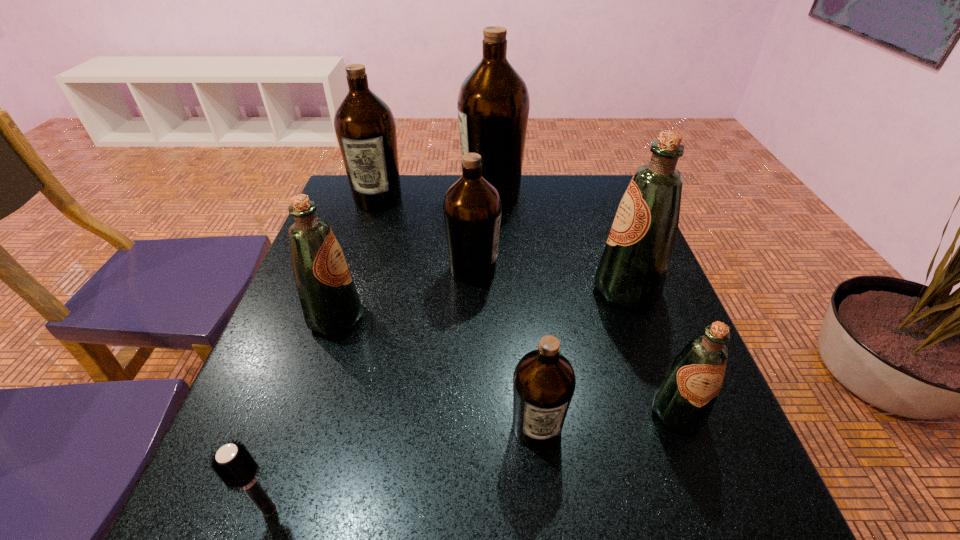
In the image, there is a desktop. Where is `vacant space at the near right corner`? vacant space at the near right corner is located at coordinates (733, 529).

This screenshot has height=540, width=960. I want to click on free space between the hairbrush and the biggest brown olive oil, so (x=380, y=352).

This screenshot has width=960, height=540. In order to click on free space between the third farthest brown olive oil and the biggest green olive oil in this screenshot , I will do `click(550, 279)`.

Locate an element on the screen. unoccupied area between the second nearest brown olive oil and the nearest green olive oil is located at coordinates (575, 341).

Identify the location of vacant area between the third smallest brown olive oil and the smallest green olive oil. (527, 305).

Locate an element on the screen. vacant space that is in between the nearest green olive oil and the second smallest brown olive oil is located at coordinates coord(575,341).

This screenshot has width=960, height=540. What are the coordinates of `free spot between the third biggest brown olive oil and the leftmost green olive oil` in the screenshot? It's located at (404, 294).

Find the location of a particular element. empty location between the hairbrush and the tallest olive oil is located at coordinates (380, 352).

At what (x,y) coordinates should I click in order to perform the action: click on free space between the third farthest brown olive oil and the biggest green olive oil. Please return your answer as a coordinate pair (x, y). Looking at the image, I should click on (550, 279).

Identify the location of blank region between the nearest object and the smallest brown olive oil. 403,468.